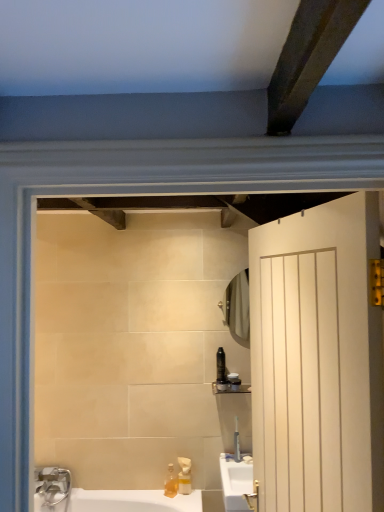
Question: Is translucent plastic soap dispenser at lower center, arranged as the 2th soap dispenser when viewed from the right, positioned far away from matte black shelf at upper center?

Choices:
 (A) yes
 (B) no

Answer: (B)

Question: Can you confirm if translucent plastic soap dispenser at lower center, arranged as the 2th soap dispenser when viewed from the right, is bigger than matte black shelf at upper center?

Choices:
 (A) yes
 (B) no

Answer: (B)

Question: From a real-world perspective, is translucent plastic soap dispenser at lower center, placed as the first soap dispenser when sorted from left to right, physically above matte black shelf at upper center?

Choices:
 (A) no
 (B) yes

Answer: (A)

Question: From a real-world perspective, is translucent plastic soap dispenser at lower center, placed as the first soap dispenser when sorted from left to right, below matte black shelf at upper center?

Choices:
 (A) no
 (B) yes

Answer: (B)

Question: From the image's perspective, does translucent plastic soap dispenser at lower center, arranged as the 2th soap dispenser when viewed from the right, appear lower than matte black shelf at upper center?

Choices:
 (A) no
 (B) yes

Answer: (B)

Question: Is black plastic toothbrush at upper center, the first toiletry from the top, wider or thinner than clear plastic tube at upper center, positioned as the fourth toiletry in top-to-bottom order?

Choices:
 (A) wide
 (B) thin

Answer: (A)

Question: From the image's perspective, is black plastic toothbrush at upper center, the first toiletry from the top, positioned above or below clear plastic tube at upper center, which ranks as the first toiletry in bottom-to-top order?

Choices:
 (A) below
 (B) above

Answer: (B)

Question: In the image, is black plastic toothbrush at upper center, the first toiletry from the top, positioned in front of or behind clear plastic tube at upper center, which ranks as the first toiletry in bottom-to-top order?

Choices:
 (A) front
 (B) behind

Answer: (B)

Question: From their relative heights in the image, would you say black plastic toothbrush at upper center, the first toiletry from the top, is taller or shorter than clear plastic tube at upper center, which ranks as the first toiletry in bottom-to-top order?

Choices:
 (A) tall
 (B) short

Answer: (B)

Question: Is white wood door at right wider or thinner than matte glass mirror at upper center?

Choices:
 (A) wide
 (B) thin

Answer: (A)

Question: Is point (357, 234) positioned closer to the camera than point (228, 291)?

Choices:
 (A) closer
 (B) farther

Answer: (A)

Question: From a real-world perspective, is white wood door at right above or below matte glass mirror at upper center?

Choices:
 (A) above
 (B) below

Answer: (B)

Question: Choose the correct answer: Is white wood door at right inside matte glass mirror at upper center or outside it?

Choices:
 (A) inside
 (B) outside

Answer: (B)

Question: Is matte black shelf at upper center inside or outside of matte glass mirror at upper center?

Choices:
 (A) inside
 (B) outside

Answer: (B)

Question: From a real-world perspective, relative to matte glass mirror at upper center, is matte black shelf at upper center vertically above or below?

Choices:
 (A) above
 (B) below

Answer: (B)